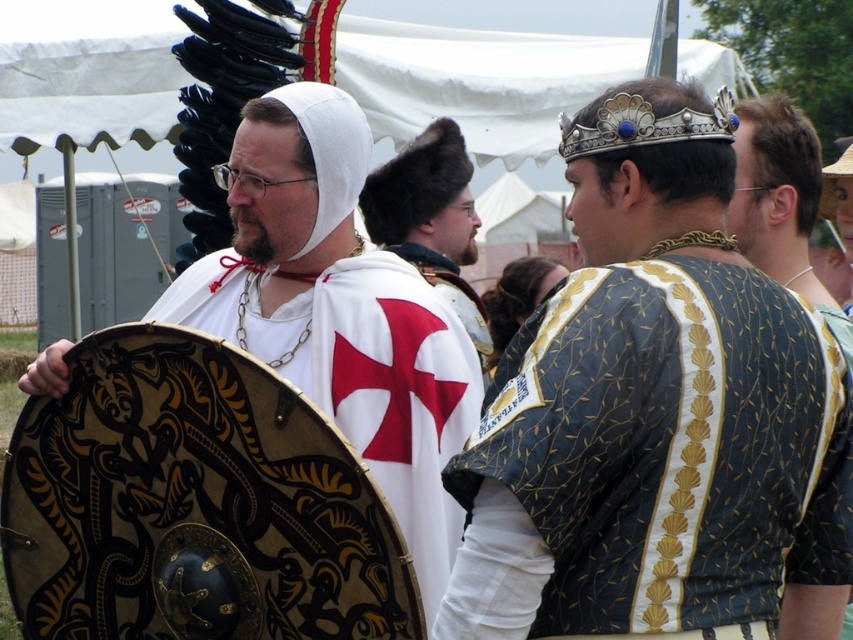
Who is shorter, white matte/soft cloth at center or white cloth at center?

white cloth at center

From the picture: Is white matte/soft cloth at center below white cloth at center?

Yes.

Describe the element at coordinates (339, 310) in the screenshot. I see `white matte/soft cloth at center` at that location.

At what (x,y) coordinates should I click in order to perform the action: click on white matte/soft cloth at center. Please return your answer as a coordinate pair (x, y). Looking at the image, I should click on (339, 310).

What do you see at coordinates (656, 413) in the screenshot? I see `gold embroidered tunic at center` at bounding box center [656, 413].

How far apart are gold embroidered tunic at center and white matte/soft cloth at center?

gold embroidered tunic at center is 1.37 meters from white matte/soft cloth at center.

Does point (561, 364) come in front of point (306, 86)?

Yes, it is in front of point (306, 86).

Find the location of a particular element. Image resolution: width=853 pixels, height=640 pixels. gold embroidered tunic at center is located at coordinates (656, 413).

Consider the image. Is gold embroidered tunic at center shorter than white cloth at center?

No, gold embroidered tunic at center is not shorter than white cloth at center.

Which is below, gold embroidered tunic at center or white cloth at center?

Positioned lower is gold embroidered tunic at center.

Who is more forward, (606, 100) or (426, 140)?

Positioned in front is point (606, 100).

Identify the location of gold embroidered tunic at center. (656, 413).